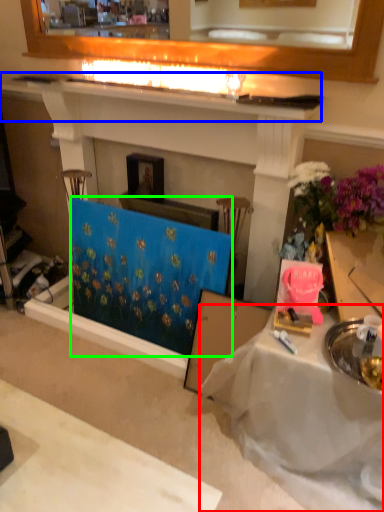
Question: Estimate the real-world distances between objects in this image. Which object is closer to table (highlighted by a red box), mantle (highlighted by a blue box) or curtain (highlighted by a green box)?

Choices:
 (A) mantle
 (B) curtain

Answer: (B)